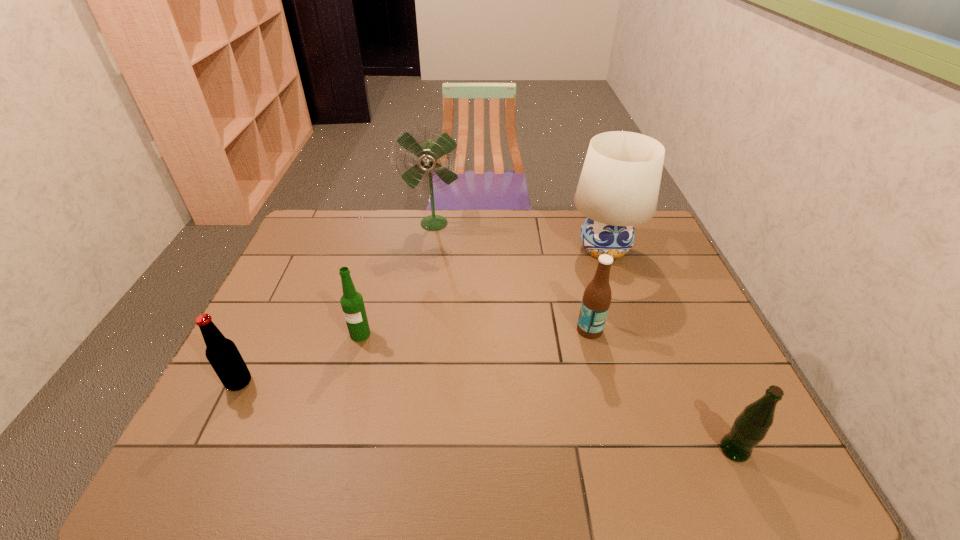
I want to click on free space located 0.140m on the right of the second beer bottle from right to left, so click(x=653, y=330).

This screenshot has width=960, height=540. Identify the location of free location located 0.190m on the label of the second beer bottle from left to right. (342, 403).

What are the coordinates of `vacant space located 0.090m on the back of the leftmost beer bottle` in the screenshot? It's located at (257, 345).

At what (x,y) coordinates should I click in order to perform the action: click on vacant space located 0.400m on the left of the nearest beer bottle. Please return your answer as a coordinate pair (x, y). The height and width of the screenshot is (540, 960). Looking at the image, I should click on (537, 450).

Where is `fan situated at the far edge`? fan situated at the far edge is located at coordinates (428, 153).

You are a GUI agent. You are given a task and a screenshot of the screen. Output one action in this format:
    pyautogui.click(x=<x>, y=<y>)
    Task: Click on the lampshade that is positioned at the far edge
    Image resolution: width=960 pixels, height=540 pixels.
    Given the screenshot: What is the action you would take?
    pyautogui.click(x=618, y=188)

What are the coordinates of `object at the near edge` in the screenshot? It's located at (750, 427).

This screenshot has height=540, width=960. I want to click on object situated at the left edge, so click(223, 355).

The image size is (960, 540). Identify the location of lampshade that is at the right edge. (618, 188).

The image size is (960, 540). What are the coordinates of `beer bottle that is at the right edge` in the screenshot? It's located at (750, 427).